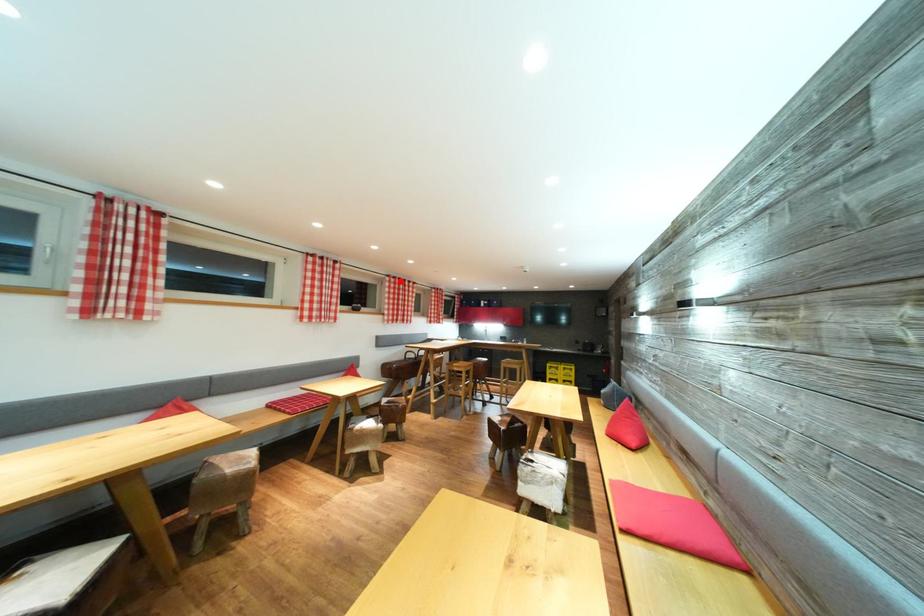
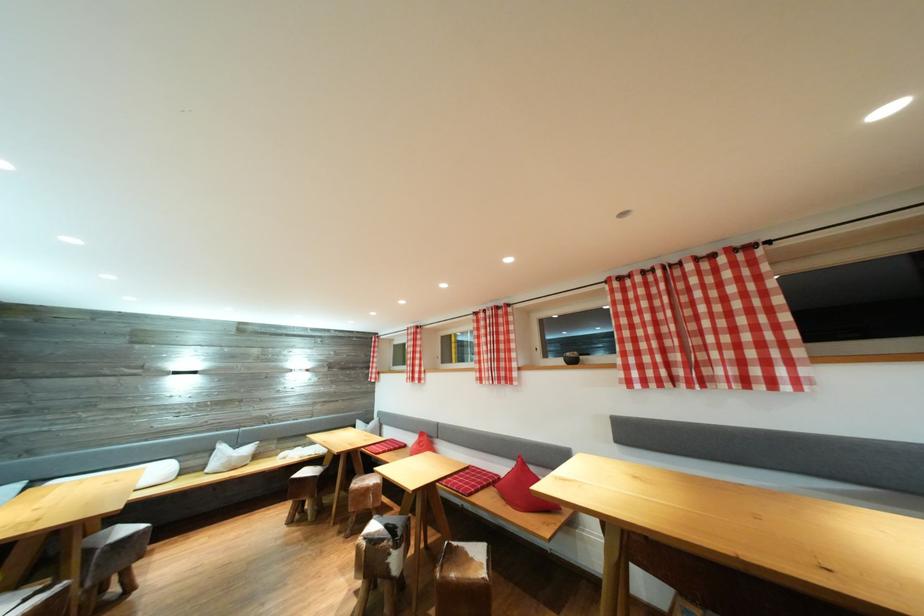
The point at the highlighted location is marked in the first image. Where is the corresponding point in the second image?

(631, 278)